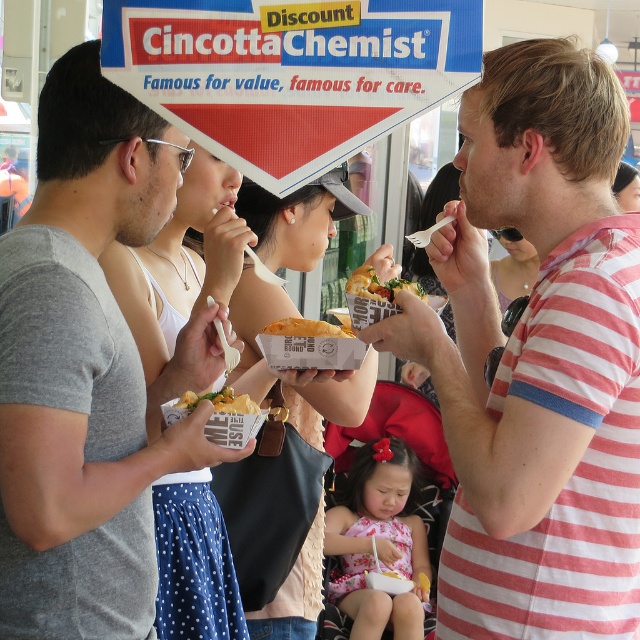
You are at the food event and want to take a photo of both the Discount Cincotta Chemist sign and the person holding the container with a fork. The sign is located at point (483, 285) and the person is at point (106, 572). To ensure both are in the frame, should you position yourself closer to the sign or the person?

You should position yourself closer to the person at point (106, 572) because point (483, 285) is behind it. This way, both the sign and the person will be visible in the frame.

You are standing at the origin point in the image. Which direction should you move to reach the striped cotton shirt at right?

The striped cotton shirt at right is located at point 0.559 in the x axis and 0.841 in the y axis. Since you are at the origin point, you should move towards the right and upwards to reach the striped cotton shirt at right.